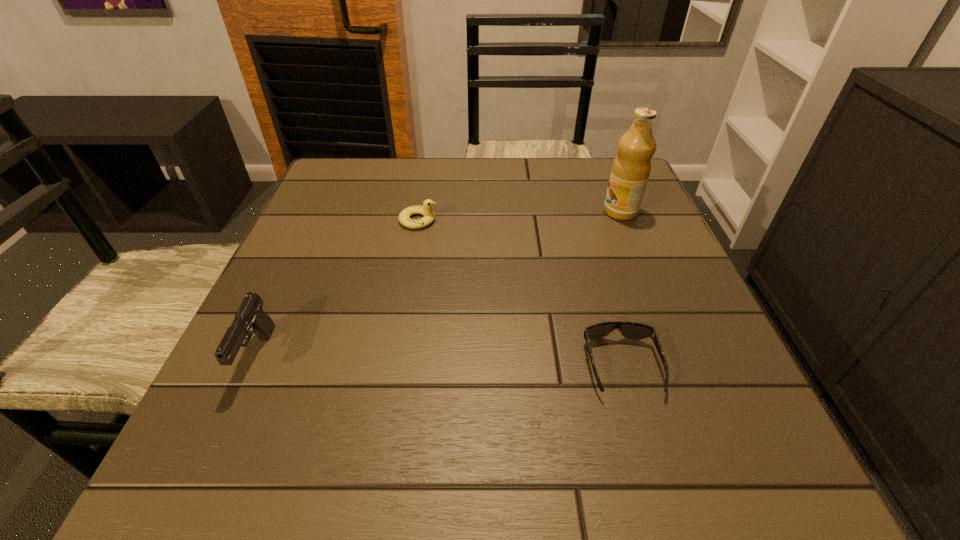
This screenshot has height=540, width=960. In order to click on olive oil in this screenshot , I will do `click(631, 168)`.

Find the location of a particular element. This screenshot has height=540, width=960. the third shortest object is located at coordinates (250, 318).

Image resolution: width=960 pixels, height=540 pixels. Find the location of `pistol`. pistol is located at coordinates (250, 318).

Identify the location of duckling. The height and width of the screenshot is (540, 960). (404, 217).

What are the coordinates of `the second object from left to right` in the screenshot? It's located at (404, 217).

Image resolution: width=960 pixels, height=540 pixels. Identify the location of sunglasses. (632, 330).

The image size is (960, 540). I want to click on vacant space situated 0.110m on the label of the olive oil, so click(555, 212).

Where is `free space located 0.270m on the label of the olive oil`? This screenshot has height=540, width=960. free space located 0.270m on the label of the olive oil is located at coordinates (485, 212).

Find the location of `free location located on the label of the olive oil`. free location located on the label of the olive oil is located at coordinates (533, 212).

The height and width of the screenshot is (540, 960). I want to click on free location located 0.120m aim along the barrel of the third shortest object, so click(x=206, y=470).